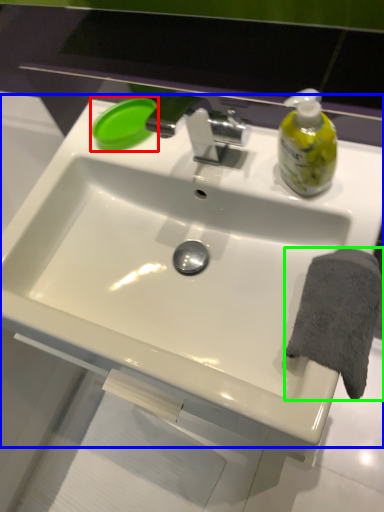
Question: Considering the real-world distances, which object is farthest from soap (highlighted by a red box)? sink (highlighted by a blue box) or bath towel (highlighted by a green box)?

Choices:
 (A) sink
 (B) bath towel

Answer: (B)